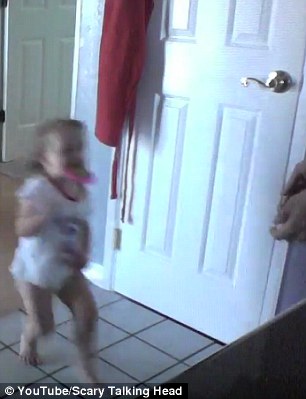
Where is `bottom door hinge`? The width and height of the screenshot is (306, 399). bottom door hinge is located at coordinates (117, 240).